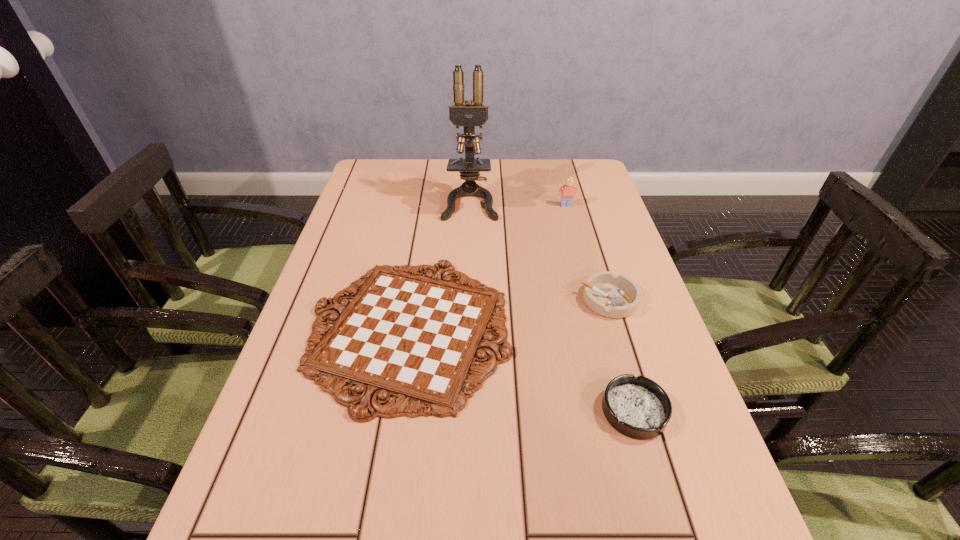
Identify the location of microscope. The height and width of the screenshot is (540, 960). (469, 115).

You are a GUI agent. You are given a task and a screenshot of the screen. Output one action in this format:
    pyautogui.click(x=<x>, y=<y>)
    Task: Click on the Lego
    
    Given the screenshot: What is the action you would take?
    pyautogui.click(x=568, y=190)

Where is `the farther ashtray`? Image resolution: width=960 pixels, height=540 pixels. the farther ashtray is located at coordinates click(612, 296).

Where is `the nearer ashtray`? the nearer ashtray is located at coordinates (637, 407).

This screenshot has width=960, height=540. I want to click on the shortest object, so click(x=416, y=338).

This screenshot has height=540, width=960. What are the coordinates of `free space located 0.400m at the eyepieces of the tallest object` in the screenshot? It's located at (467, 324).

At what (x,y) coordinates should I click in order to perform the action: click on blank space located on the front-facing side of the Lego. Please return your answer as a coordinate pair (x, y). Looking at the image, I should click on click(587, 284).

You are a GUI agent. You are given a task and a screenshot of the screen. Output one action in this format:
    pyautogui.click(x=<x>, y=<y>)
    Task: Click on the vacant space situated on the left of the farther ashtray
    This screenshot has height=540, width=960.
    Given the screenshot: What is the action you would take?
    pyautogui.click(x=560, y=300)

Identify the location of vacant space situated on the left of the nearer ashtray. The height and width of the screenshot is (540, 960). [564, 411].

Find the location of a particular element. This screenshot has height=540, width=960. vacant region located 0.150m on the right of the chessboard is located at coordinates (579, 330).